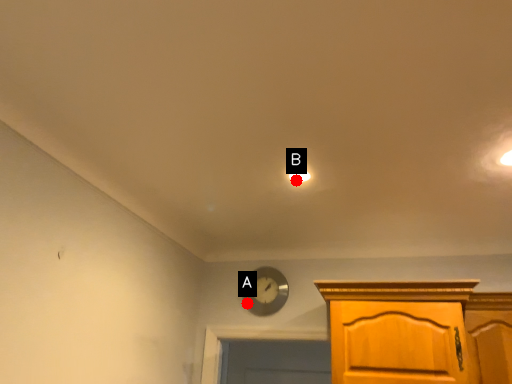
Question: Two points are circled on the image, labeled by A and B beside each circle. Which point is further to the camera?

Choices:
 (A) A is further
 (B) B is further

Answer: (A)